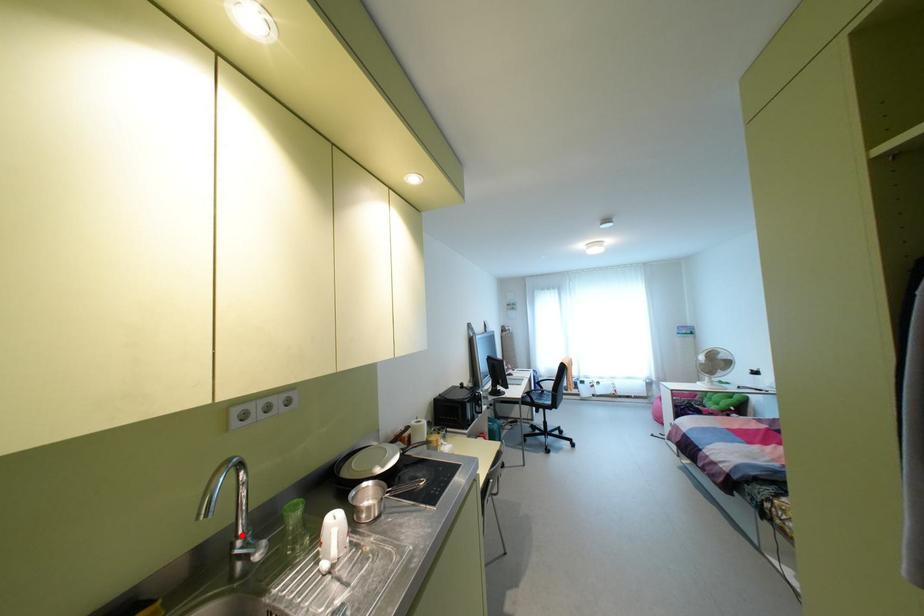
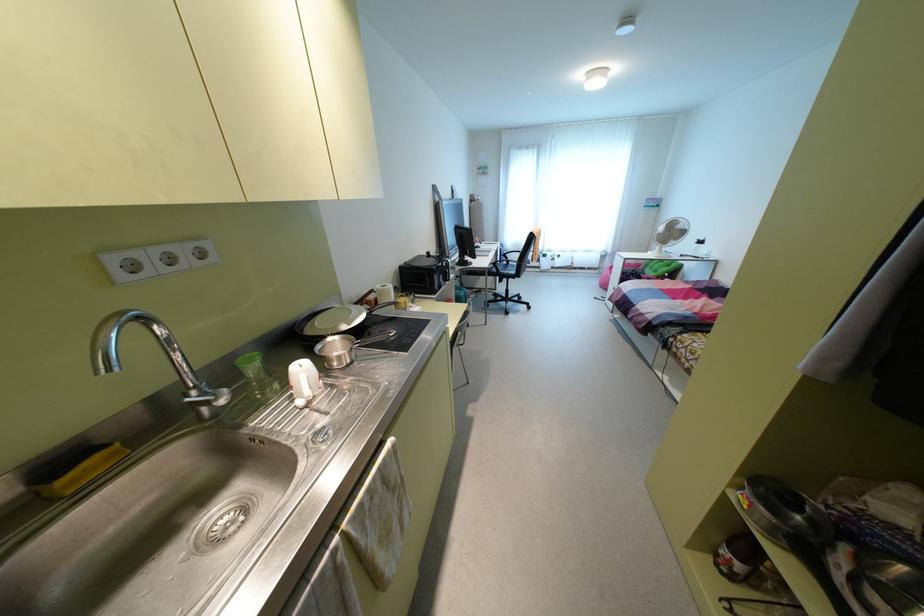
Where in the second image is the point corresponding to the highlighted location from the first image?

(195, 387)